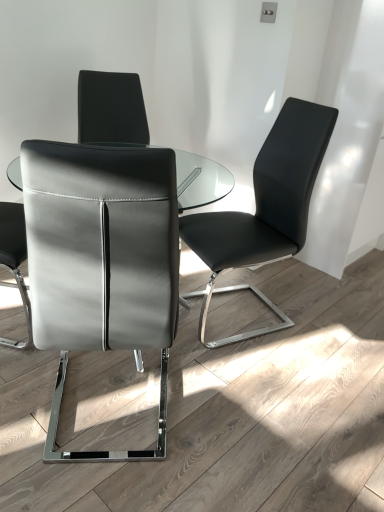
Question: Which direction should I rotate to look at black leather chair at center, the second chair positioned from the left?

Choices:
 (A) right
 (B) left

Answer: (A)

Question: From the image's perspective, would you say black leather chair at center, placed as the first chair when sorted from right to left, is positioned over matte black chair at left, positioned as the 2th chair in right-to-left order?

Choices:
 (A) yes
 (B) no

Answer: (A)

Question: Can you confirm if black leather chair at center, the second chair positioned from the left, is taller than matte black chair at left, positioned as the 2th chair in right-to-left order?

Choices:
 (A) yes
 (B) no

Answer: (A)

Question: Is black leather chair at center, placed as the first chair when sorted from right to left, in contact with matte black chair at left, the 1th chair from the left?

Choices:
 (A) yes
 (B) no

Answer: (B)

Question: Can you confirm if black leather chair at center, the second chair positioned from the left, is positioned to the left of matte black chair at left, the 1th chair from the left?

Choices:
 (A) yes
 (B) no

Answer: (B)

Question: Are black leather chair at center, the second chair positioned from the left, and matte black chair at left, the 1th chair from the left, far apart?

Choices:
 (A) no
 (B) yes

Answer: (A)

Question: Would you say matte black chair at left, positioned as the 2th chair in right-to-left order, is part of black leather chair at center, placed as the first chair when sorted from right to left,'s contents?

Choices:
 (A) yes
 (B) no

Answer: (B)

Question: From a real-world perspective, does matte black chair at left, positioned as the 2th chair in right-to-left order, stand above black leather chair at center, placed as the first chair when sorted from right to left?

Choices:
 (A) yes
 (B) no

Answer: (A)

Question: Is the surface of matte black chair at left, the 1th chair from the left, in direct contact with black leather chair at center, placed as the first chair when sorted from right to left?

Choices:
 (A) no
 (B) yes

Answer: (A)

Question: Is matte black chair at left, positioned as the 2th chair in right-to-left order, positioned in front of black leather chair at center, placed as the first chair when sorted from right to left?

Choices:
 (A) yes
 (B) no

Answer: (A)

Question: Would you say black leather chair at center, the second chair positioned from the left, is part of matte black chair at left, the 1th chair from the left,'s contents?

Choices:
 (A) yes
 (B) no

Answer: (B)

Question: Considering the relative sizes of matte black chair at left, the 1th chair from the left, and black leather chair at center, the second chair positioned from the left, in the image provided, is matte black chair at left, the 1th chair from the left, shorter than black leather chair at center, the second chair positioned from the left,?

Choices:
 (A) yes
 (B) no

Answer: (A)

Question: Does matte black chair at left, the 1th chair from the left, appear on the right side of black leather chair at center, placed as the first chair when sorted from right to left?

Choices:
 (A) yes
 (B) no

Answer: (B)

Question: Considering the positions of point (286, 245) and point (44, 172), is point (286, 245) closer or farther from the camera than point (44, 172)?

Choices:
 (A) farther
 (B) closer

Answer: (A)